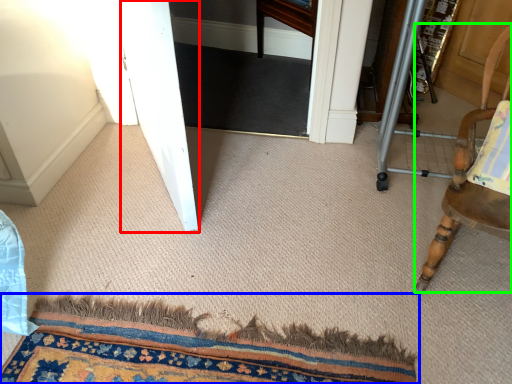
Question: Which object is the closest to the screen door (highlighted by a red box)? Choose among these: mat (highlighted by a blue box) or chair (highlighted by a green box).

Choices:
 (A) mat
 (B) chair

Answer: (A)